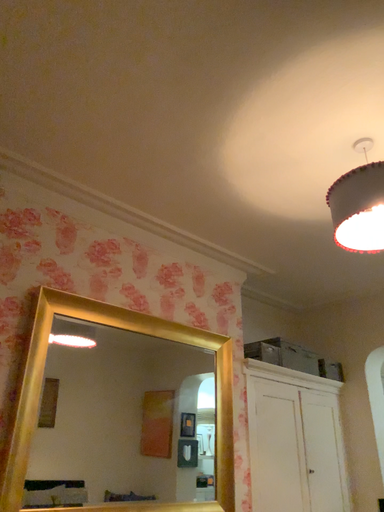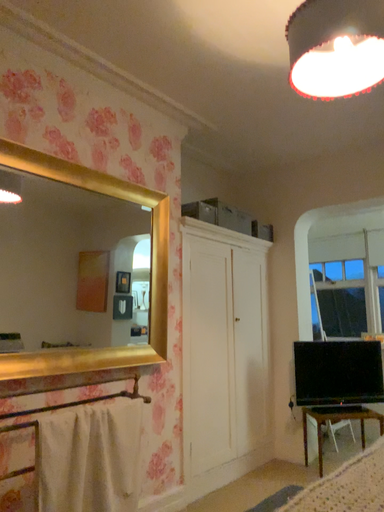
Question: Which way did the camera rotate in the video?

Choices:
 (A) rotated upward
 (B) rotated downward

Answer: (B)